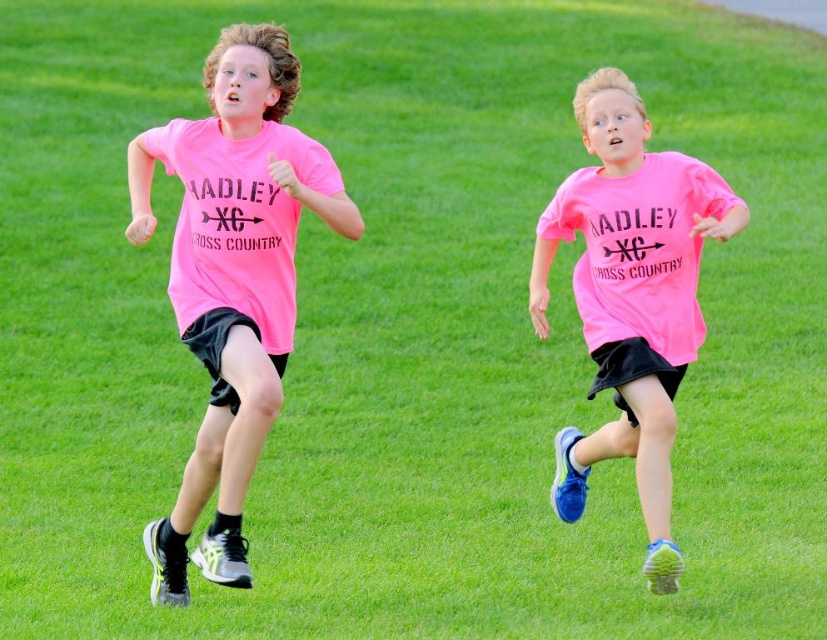
Who is higher up, pink matte shirt at left or pink matte shirt at center?

pink matte shirt at left is above.

Can you confirm if pink matte shirt at left is shorter than pink matte shirt at center?

No, pink matte shirt at left is not shorter than pink matte shirt at center.

I want to click on pink matte shirt at left, so click(232, 278).